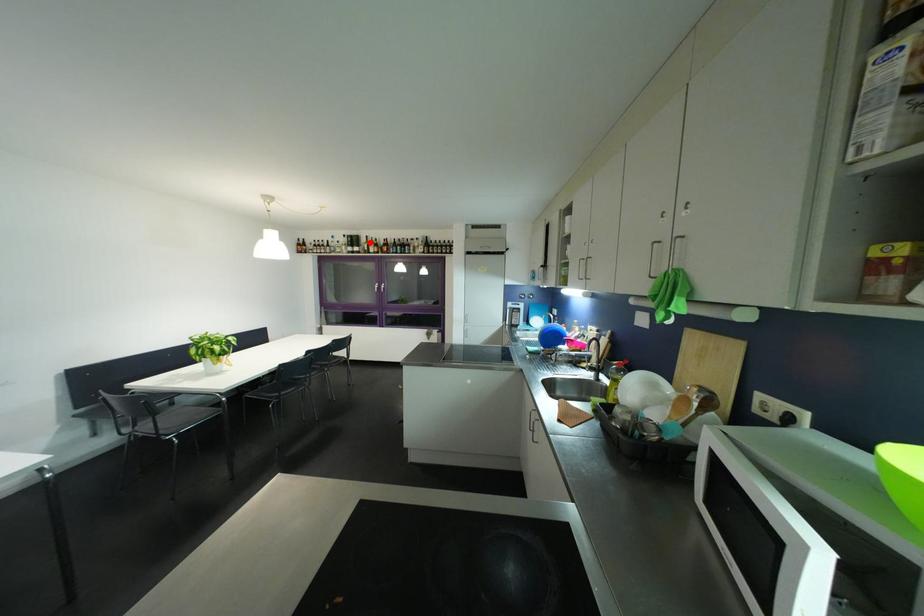
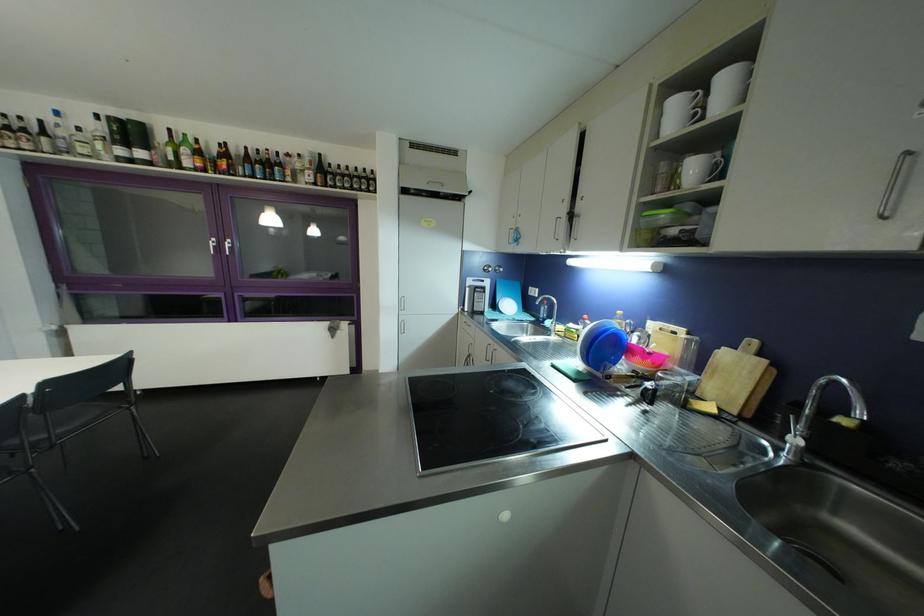
The point at the highlighted location is marked in the first image. Where is the corresponding point in the second image?

(167, 140)